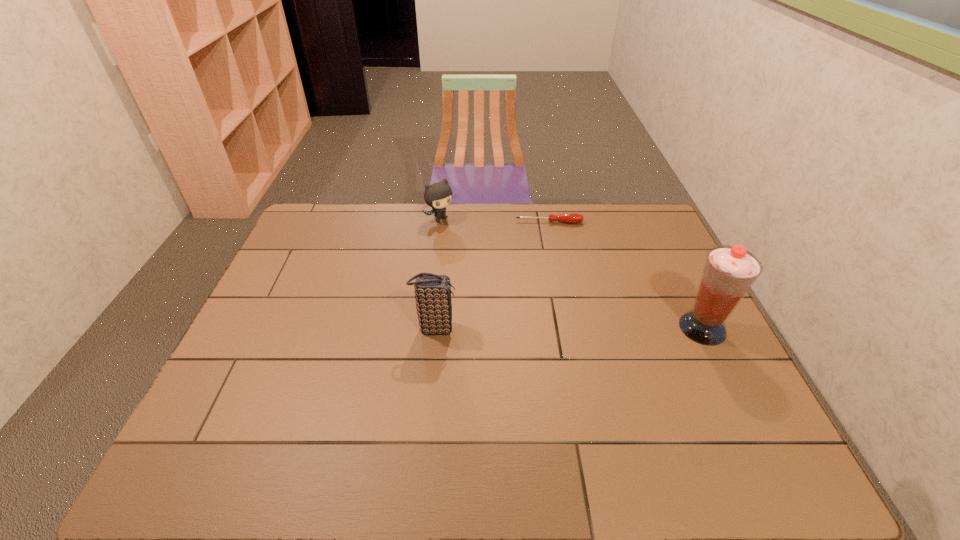
At what (x,y) coordinates should I click in order to perform the action: click on free space on the desktop that is between the clutch bag and the rightmost object and is positioned on the front-facing side of the kitten. Please return your answer as a coordinate pair (x, y). This screenshot has height=540, width=960. Looking at the image, I should click on (557, 328).

I want to click on vacant spot on the desktop that is between the clutch bag and the rightmost object and is positioned at the tip of the third object from left to right, so pyautogui.click(x=565, y=328).